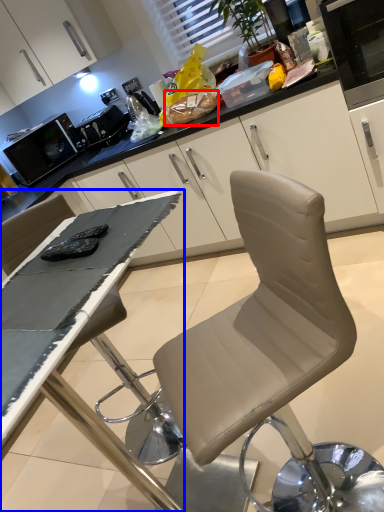
Question: Which of the following is the closest to the observer, food (highlighted by a red box) or table (highlighted by a blue box)?

Choices:
 (A) food
 (B) table

Answer: (B)